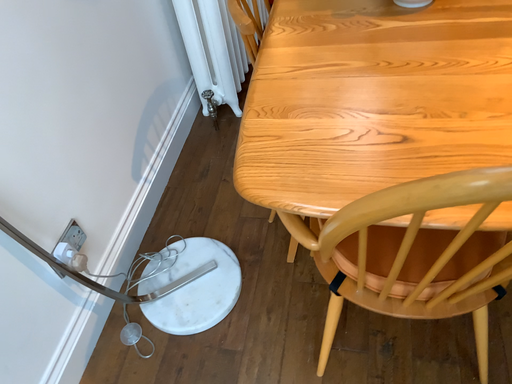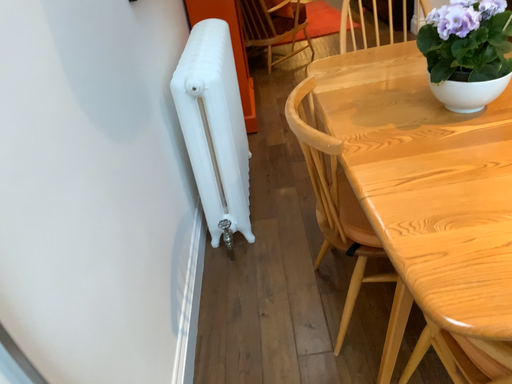
Question: How did the camera likely rotate when shooting the video?

Choices:
 (A) rotated downward
 (B) rotated upward

Answer: (B)